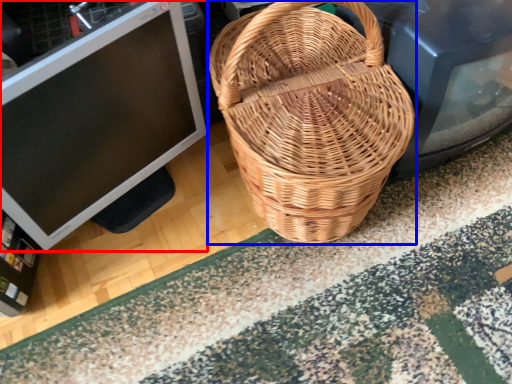
Question: Which of the following is the closest to the observer, computer monitor (highlighted by a red box) or picnic basket (highlighted by a blue box)?

Choices:
 (A) computer monitor
 (B) picnic basket

Answer: (B)